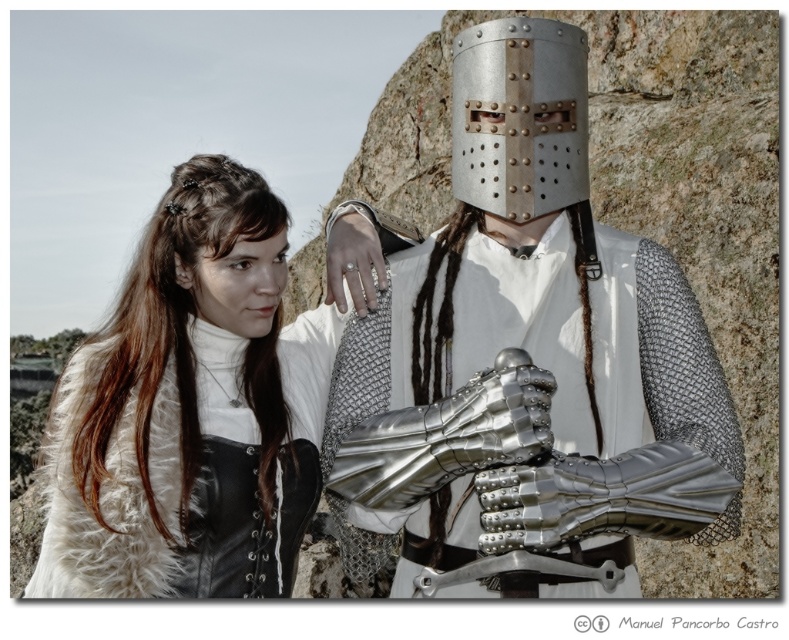
Question: Considering the relative positions of metallic chainmail armor at center and white fur vest at upper left in the image provided, where is metallic chainmail armor at center located with respect to white fur vest at upper left?

Choices:
 (A) above
 (B) below

Answer: (A)

Question: Which of the following is the closest to the observer?

Choices:
 (A) white fur vest at upper left
 (B) metallic chainmail armor at center

Answer: (B)

Question: Is metallic chainmail armor at center thinner than white fur vest at upper left?

Choices:
 (A) yes
 (B) no

Answer: (A)

Question: Which point appears farthest from the camera in this image?

Choices:
 (A) (156, 403)
 (B) (675, 486)

Answer: (A)

Question: Which point is farther to the camera?

Choices:
 (A) white fur vest at upper left
 (B) metallic chainmail armor at center

Answer: (A)

Question: Can you confirm if metallic chainmail armor at center is positioned above white fur vest at upper left?

Choices:
 (A) yes
 (B) no

Answer: (A)